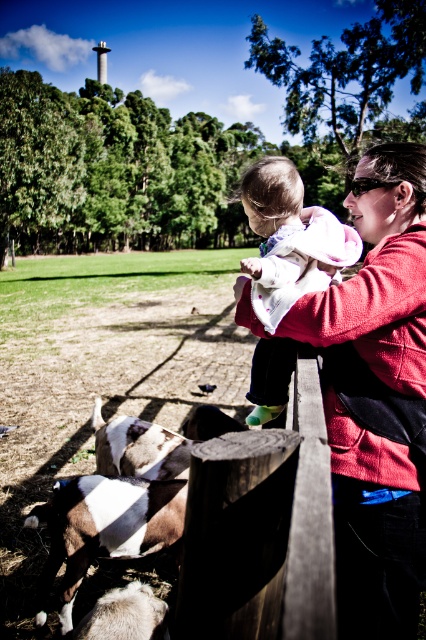
Which of these two, matte red sweater at upper right or white soft fur goat at lower left, stands taller?

With more height is matte red sweater at upper right.

Does point (339, 621) come in front of point (181, 504)?

Yes, point (339, 621) is closer to viewer.

Image resolution: width=426 pixels, height=640 pixels. Identify the location of matte red sweater at upper right. (367, 394).

Can you confirm if matte red sweater at upper right is taller than soft pink fabric baby at center?

Incorrect, matte red sweater at upper right's height is not larger of soft pink fabric baby at center's.

Between matte red sweater at upper right and soft pink fabric baby at center, which one has more height?

With more height is soft pink fabric baby at center.

Between point (374, 566) and point (261, 248), which one is positioned in front?

Point (374, 566) is more forward.

This screenshot has height=640, width=426. I want to click on matte red sweater at upper right, so click(367, 394).

The width and height of the screenshot is (426, 640). I want to click on soft pink fabric baby at center, so click(290, 241).

Is soft pink fabric baby at center smaller than white soft fur goat at lower left?

No, soft pink fabric baby at center is not smaller than white soft fur goat at lower left.

Between point (276, 170) and point (100, 480), which one is positioned behind?

Positioned behind is point (100, 480).

Find the location of a particular element. soft pink fabric baby at center is located at coordinates (290, 241).